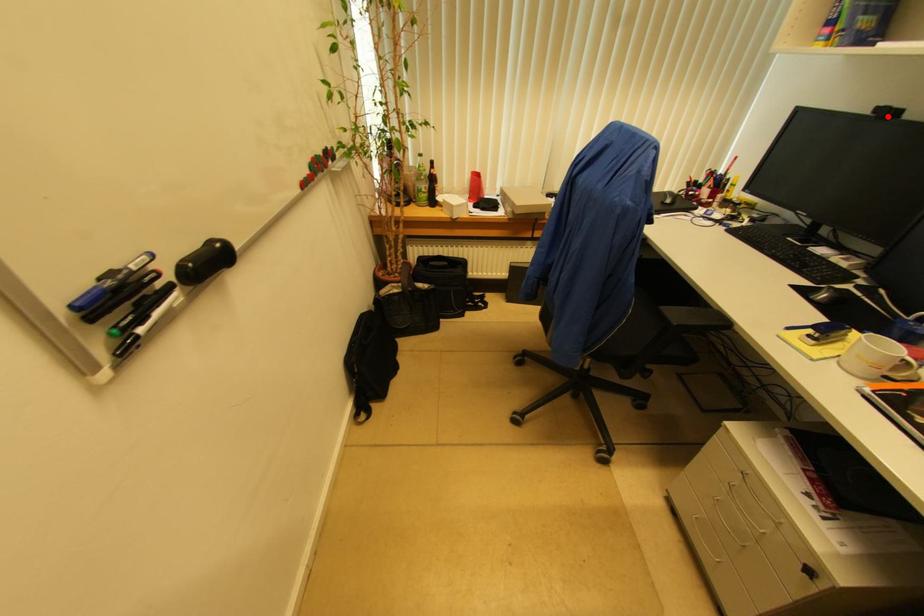
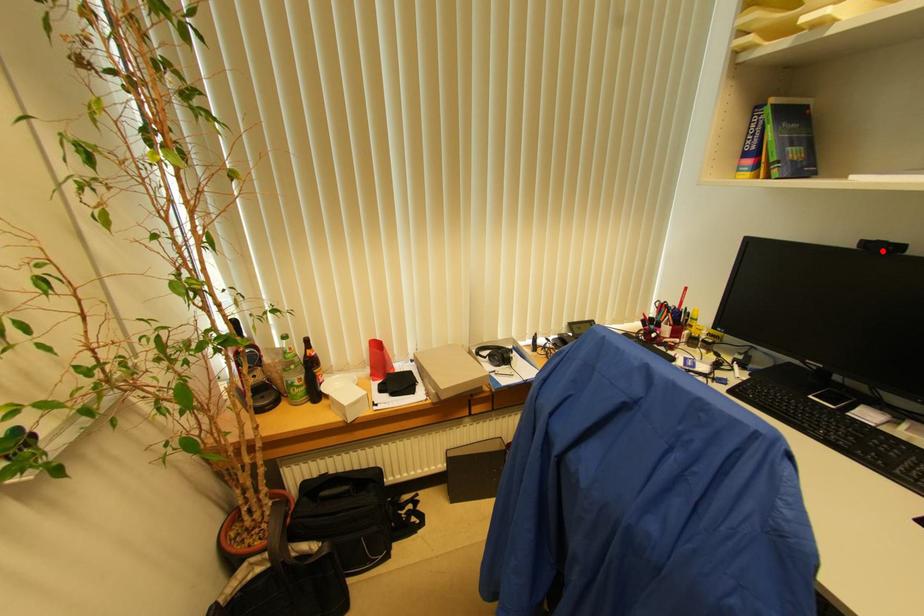
I am providing you with two images of the same scene from different viewpoints. A red point is marked on the first image and another point is marked on the second image. Does the point marked in image1 correspond to the same location as the one in image2?

Yes